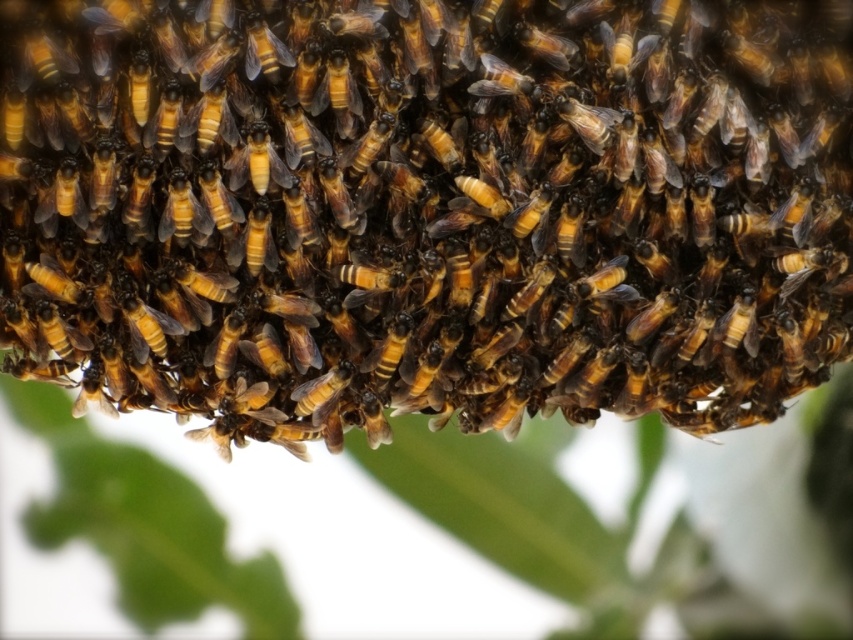
You are a beekeeper examining a beehive. You notice a brown fuzzy beehive at center and a shiny golden bee at center. Which object is wider?

The brown fuzzy beehive at center is wider than the shiny golden bee at center.

You are a beekeeper observing the brown fuzzy beehive at center and the brown fuzzy bee at center. Which object is located more to the right?

The brown fuzzy beehive at center is positioned on the right side of the brown fuzzy bee at center, so the brown fuzzy beehive at center is more to the right.

You are a photographer using a camera with a 3.5 feet focal length. You want to capture a close shot of the shiny golden bee at center. Is the bee within the camera range?

The shiny golden bee at center is 4.27 feet from the camera. Since the camera has a 3.5 feet focal length, the bee is slightly out of the camera range because it is farther away than the focal length allows.